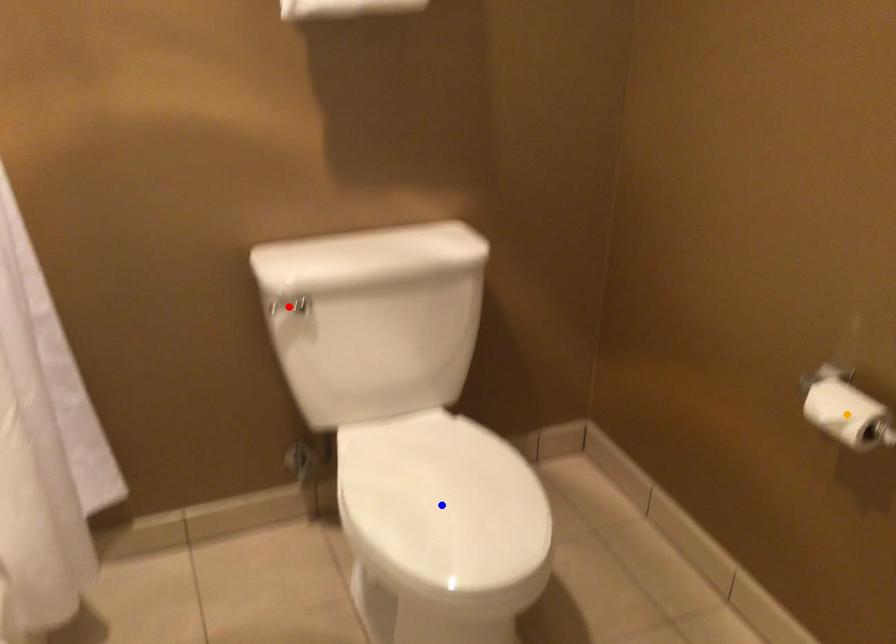
Order these from farthest to nearest:
blue point, orange point, red point

red point < blue point < orange point